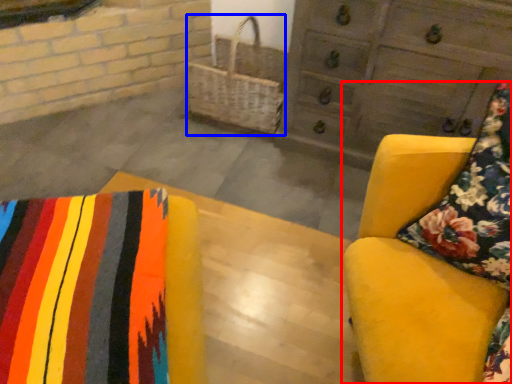
Question: Which of the following is the farthest to the observer, furniture (highlighted by a red box) or basket (highlighted by a blue box)?

Choices:
 (A) furniture
 (B) basket

Answer: (B)